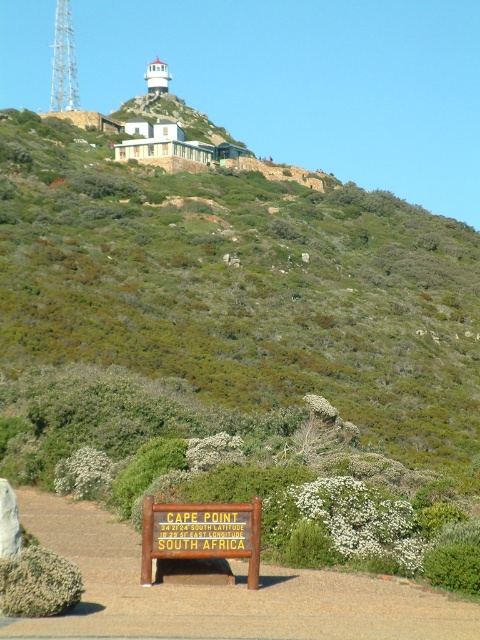
Which is more to the right, green shrubbery at upper center or brown wooden sign at lower center?

green shrubbery at upper center

The height and width of the screenshot is (640, 480). What do you see at coordinates (242, 289) in the screenshot?
I see `green shrubbery at upper center` at bounding box center [242, 289].

Where is `green shrubbery at upper center`? green shrubbery at upper center is located at coordinates (242, 289).